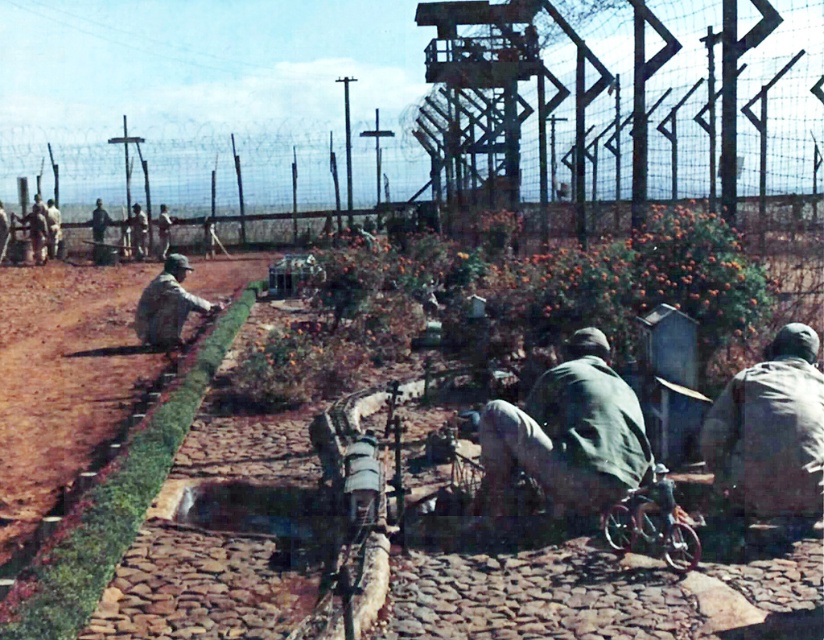
Question: Which of these objects is positioned closest to the green matte jacket at center?

Choices:
 (A) camouflage fabric uniform at lower right
 (B) camouflage fabric uniform at center

Answer: (A)

Question: Is camouflage fabric uniform at lower right thinner than camouflage fabric uniform at center?

Choices:
 (A) yes
 (B) no

Answer: (B)

Question: Can you confirm if green matte jacket at center is smaller than camouflage fabric uniform at lower right?

Choices:
 (A) yes
 (B) no

Answer: (B)

Question: Among these points, which one is farthest from the camera?

Choices:
 (A) (734, 490)
 (B) (578, 340)

Answer: (B)

Question: Does green matte jacket at center appear on the left side of camouflage fabric uniform at center?

Choices:
 (A) no
 (B) yes

Answer: (A)

Question: Which is farther from the green matte jacket at center?

Choices:
 (A) camouflage fabric uniform at lower right
 (B) camouflage fabric uniform at center

Answer: (B)